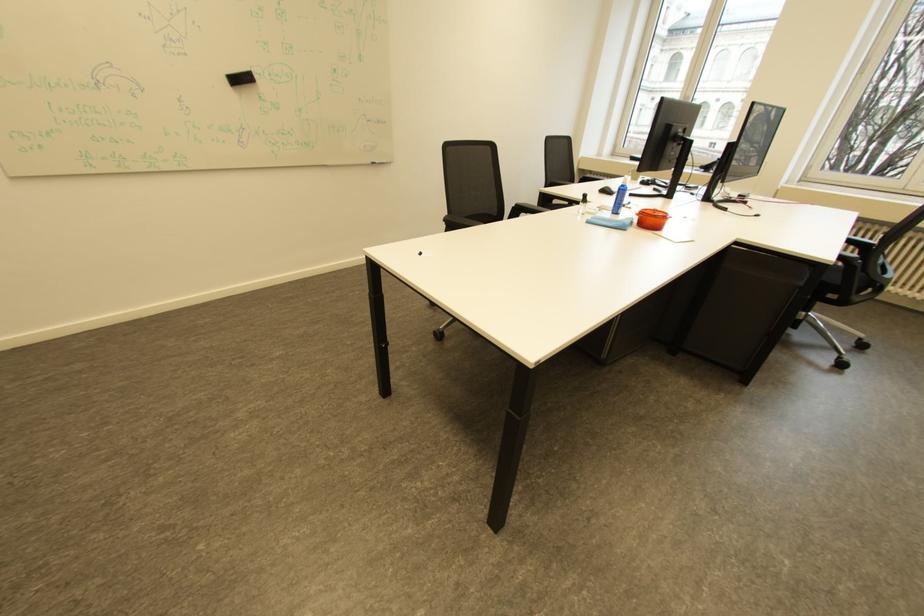
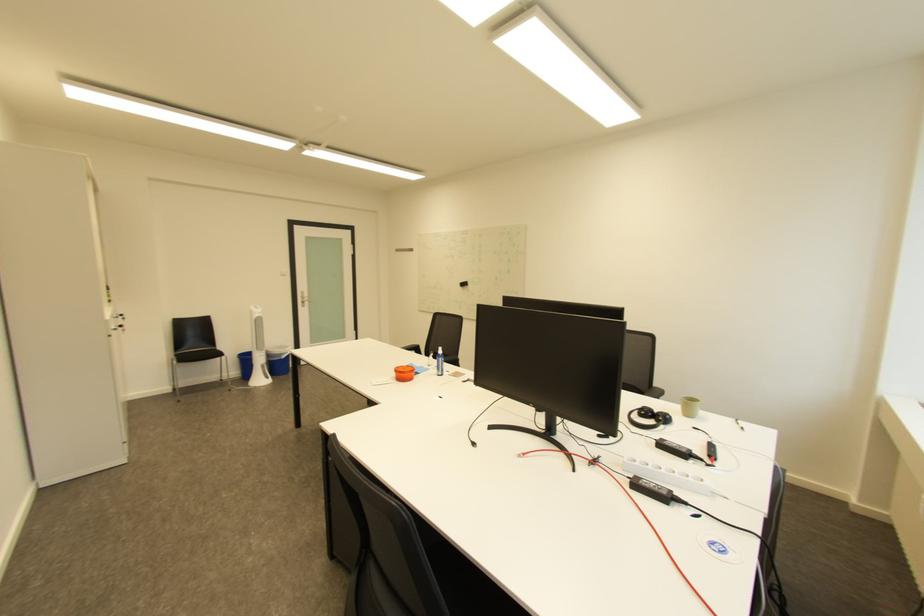
Question: I am providing you with two images of the same scene from different viewpoints. After the viewpoint changes to image2, which objects are now occluded?

Choices:
 (A) beige lampshade
 (B) blue spray bottle
 (C) computer mouse
 (D) silver door handle

Answer: (C)